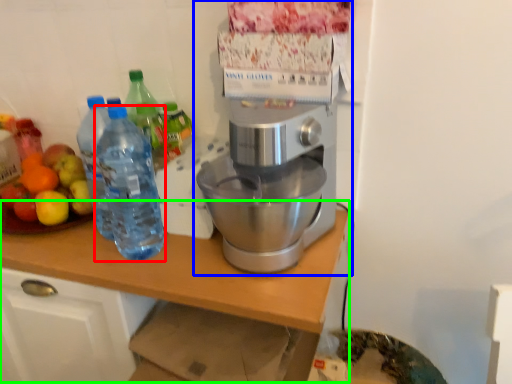
Question: Estimate the real-world distances between objects in this image. Which object is farther from bottle (highlighted by a red box), coffee maker (highlighted by a blue box) or table (highlighted by a green box)?

Choices:
 (A) coffee maker
 (B) table

Answer: (A)